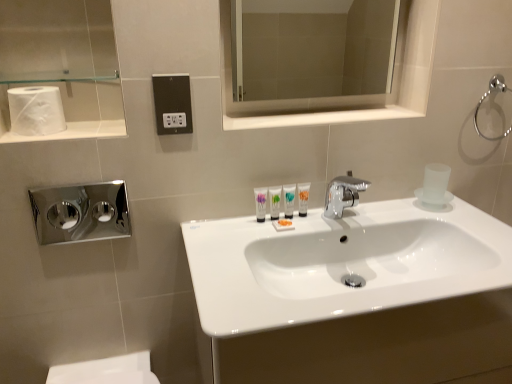
You are a GUI agent. You are given a task and a screenshot of the screen. Output one action in this format:
    pyautogui.click(x=<x>, y=<y>)
    Task: Click on the free point in front of white glossy tube at center, which ranks as the first toiletry in right-to-left order
    This screenshot has height=384, width=512.
    Given the screenshot: What is the action you would take?
    pyautogui.click(x=267, y=237)